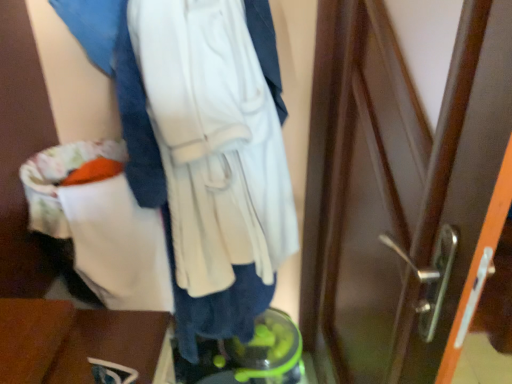
Question: Is the position of white soft sweatshirt at center more distant than that of wooden table at lower left?

Choices:
 (A) no
 (B) yes

Answer: (A)

Question: From a real-world perspective, does white soft sweatshirt at center stand above wooden table at lower left?

Choices:
 (A) yes
 (B) no

Answer: (A)

Question: Can you confirm if white soft sweatshirt at center is positioned to the left of wooden table at lower left?

Choices:
 (A) yes
 (B) no

Answer: (B)

Question: Is white soft sweatshirt at center shorter than wooden table at lower left?

Choices:
 (A) no
 (B) yes

Answer: (A)

Question: Considering the relative sizes of white soft sweatshirt at center and wooden table at lower left in the image provided, is white soft sweatshirt at center bigger than wooden table at lower left?

Choices:
 (A) yes
 (B) no

Answer: (A)

Question: Is white soft sweatshirt at center taller than wooden table at lower left?

Choices:
 (A) yes
 (B) no

Answer: (A)

Question: Does wooden table at lower left have a smaller size compared to white soft sweatshirt at center?

Choices:
 (A) no
 (B) yes

Answer: (B)

Question: Can you confirm if wooden table at lower left is shorter than white soft sweatshirt at center?

Choices:
 (A) no
 (B) yes

Answer: (B)

Question: From the image's perspective, does wooden table at lower left appear lower than white soft sweatshirt at center?

Choices:
 (A) no
 (B) yes

Answer: (B)

Question: Does wooden table at lower left appear on the left side of white soft sweatshirt at center?

Choices:
 (A) yes
 (B) no

Answer: (A)

Question: Is wooden table at lower left touching white soft sweatshirt at center?

Choices:
 (A) yes
 (B) no

Answer: (B)

Question: Is wooden table at lower left facing towards white soft sweatshirt at center?

Choices:
 (A) no
 (B) yes

Answer: (A)

Question: Is wooden table at lower left bigger or smaller than white soft sweatshirt at center?

Choices:
 (A) big
 (B) small

Answer: (B)